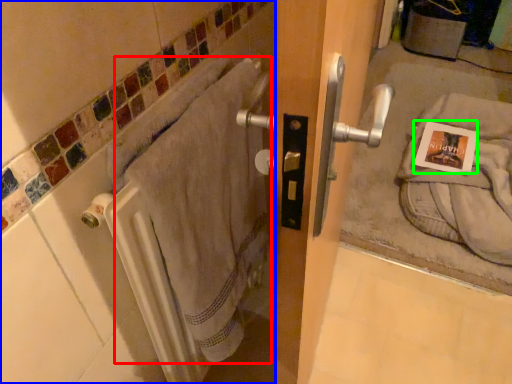
Question: Which is nearer to the bath towel (highlighted by a red box)? bath (highlighted by a blue box) or postcard (highlighted by a green box).

Choices:
 (A) bath
 (B) postcard

Answer: (A)